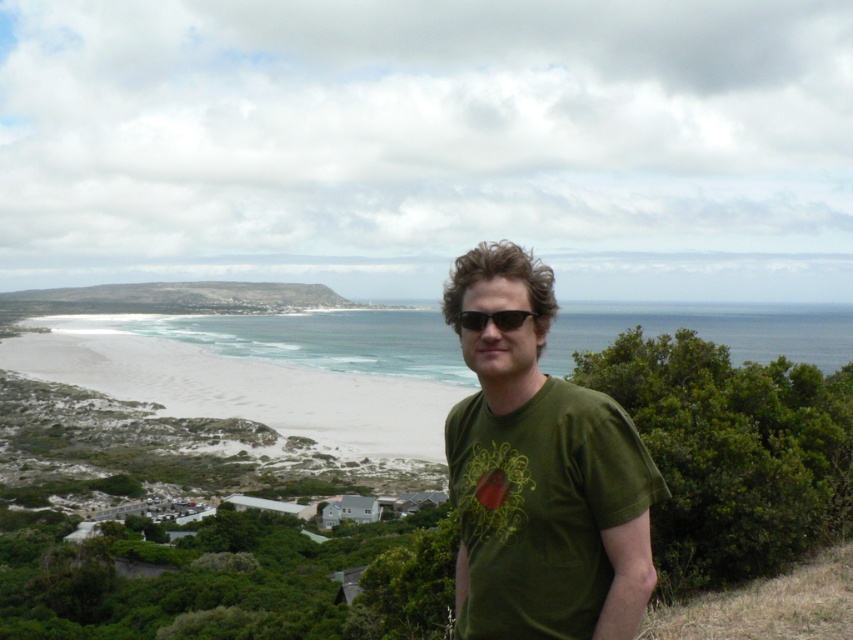
Question: Which object is farther from the camera taking this photo?

Choices:
 (A) green matte t-shirt at center
 (B) black plastic sunglasses at center

Answer: (B)

Question: Considering the real-world distances, which object is closest to the black plastic sunglasses at center?

Choices:
 (A) green grassy hillside at center
 (B) green matte t-shirt at center

Answer: (B)

Question: Does green grassy hillside at center appear under black plastic sunglasses at center?

Choices:
 (A) no
 (B) yes

Answer: (A)

Question: Can you confirm if green matte t-shirt at center is positioned above black plastic sunglasses at center?

Choices:
 (A) yes
 (B) no

Answer: (B)

Question: Observing the image, what is the correct spatial positioning of green matte t-shirt at center in reference to black plastic sunglasses at center?

Choices:
 (A) above
 (B) below

Answer: (B)

Question: Which object appears farthest from the camera in this image?

Choices:
 (A) green matte t-shirt at center
 (B) green grassy hillside at center
 (C) black plastic sunglasses at center

Answer: (B)